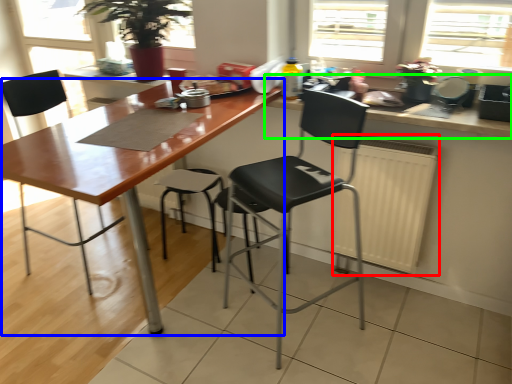
Question: Estimate the real-world distances between objects in this image. Which object is farther from radiator (highlighted by a red box), table (highlighted by a blue box) or countertop (highlighted by a green box)?

Choices:
 (A) table
 (B) countertop

Answer: (A)